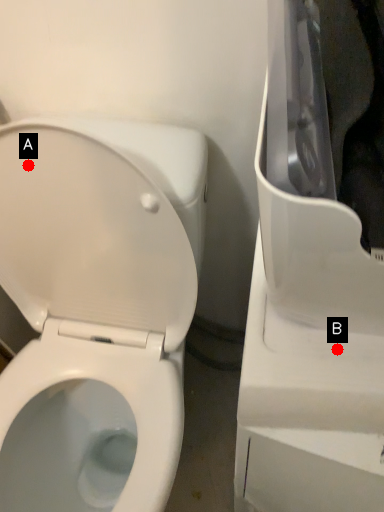
Question: Two points are circled on the image, labeled by A and B beside each circle. Which point is farther from the camera taking this photo?

Choices:
 (A) A is further
 (B) B is further

Answer: (A)